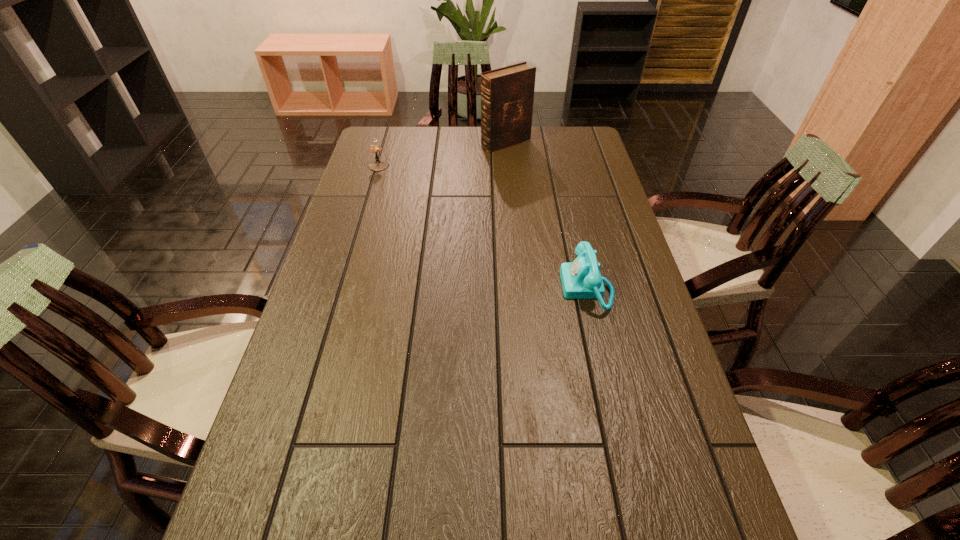
Find the location of a particular element. blank region between the telephone and the second farthest object is located at coordinates (483, 227).

You are a GUI agent. You are given a task and a screenshot of the screen. Output one action in this format:
    pyautogui.click(x=<x>, y=<y>)
    Task: Click on the empty location between the telephone and the leftmost object
    The image size is (960, 540).
    Given the screenshot: What is the action you would take?
    pyautogui.click(x=483, y=227)

The width and height of the screenshot is (960, 540). I want to click on vacant space that is in between the second nearest object and the Bible, so click(x=443, y=154).

Locate which object is the closest to the leftmost object. Please provide its 2D coordinates. Your answer should be formatted as a tuple, i.e. [(x, y)], where the tuple contains the x and y coordinates of a point satisfying the conditions above.

[(507, 94)]

Identify the location of object that is the second closest to the farthest object. The height and width of the screenshot is (540, 960). pyautogui.click(x=581, y=279).